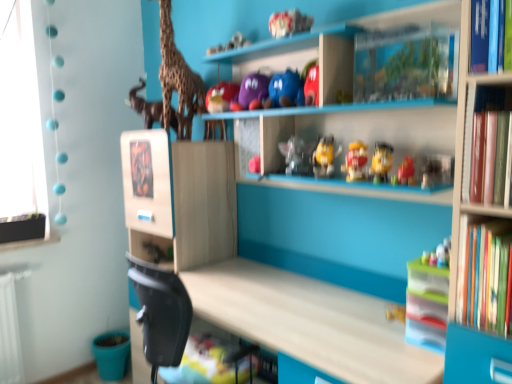
Measure the distance between matte purple plush at upper center, which appears as the first toy when viewed from the top, and camera.

The depth of matte purple plush at upper center, which appears as the first toy when viewed from the top, is 6.51 feet.

Where is `matte brown elephant at upper left`? matte brown elephant at upper left is located at coordinates tap(145, 106).

The image size is (512, 384). I want to click on translucent plastic toy at center, which ranks as the fifth toy in top-to-bottom order, so click(x=356, y=162).

The image size is (512, 384). What are the coordinates of `translucent plastic figurine at center, the 3th toy positioned from the top` in the screenshot? It's located at (296, 156).

At what (x,y) coordinates should I click in order to perform the action: click on hardcover books at right. Please return your answer as a coordinate pair (x, y). This screenshot has width=512, height=384. Looking at the image, I should click on (485, 276).

Find the location of a particular element. Image resolution: width=512 pixels, height=384 pixels. matte purple plush at upper center, acting as the 6th toy starting from the bottom is located at coordinates 230,44.

Does purple matte plush at upper center, acting as the 2th toy starting from the top, have a greater width compared to matte purple plush at upper center, acting as the 6th toy starting from the bottom?

Yes, purple matte plush at upper center, acting as the 2th toy starting from the top, is wider than matte purple plush at upper center, acting as the 6th toy starting from the bottom.

Which is correct: purple matte plush at upper center, the fifth toy when ordered from bottom to top, is inside matte purple plush at upper center, which appears as the first toy when viewed from the top, or outside of it?

purple matte plush at upper center, the fifth toy when ordered from bottom to top, is located beyond the bounds of matte purple plush at upper center, which appears as the first toy when viewed from the top.

From a real-world perspective, is purple matte plush at upper center, acting as the 2th toy starting from the top, positioned above or below matte purple plush at upper center, acting as the 6th toy starting from the bottom?

In terms of real-world spatial position, purple matte plush at upper center, acting as the 2th toy starting from the top, is below matte purple plush at upper center, acting as the 6th toy starting from the bottom.

Is the position of purple matte plush at upper center, the fifth toy when ordered from bottom to top, less distant than that of matte purple plush at upper center, acting as the 6th toy starting from the bottom?

Yes, it is in front of matte purple plush at upper center, acting as the 6th toy starting from the bottom.

From the image's perspective, is purple matte plush at upper center, the fifth toy when ordered from bottom to top, on top of wooden giraffe at upper left?

No.

Considering the positions of objects purple matte plush at upper center, acting as the 2th toy starting from the top, and wooden giraffe at upper left in the image provided, who is in front, purple matte plush at upper center, acting as the 2th toy starting from the top, or wooden giraffe at upper left?

purple matte plush at upper center, acting as the 2th toy starting from the top, is more forward.

In terms of height, does purple matte plush at upper center, acting as the 2th toy starting from the top, look taller or shorter compared to wooden giraffe at upper left?

purple matte plush at upper center, acting as the 2th toy starting from the top, is shorter than wooden giraffe at upper left.

Which of these two, purple matte plush at upper center, the fifth toy when ordered from bottom to top, or wooden giraffe at upper left, is thinner?

purple matte plush at upper center, the fifth toy when ordered from bottom to top.

Can you confirm if matte yellow toy at center, arranged as the sixth toy when viewed from the top, is taller than wooden giraffe at upper left?

Incorrect, the height of matte yellow toy at center, arranged as the sixth toy when viewed from the top, is not larger of that of wooden giraffe at upper left.

From a real-world perspective, is matte yellow toy at center, arranged as the sixth toy when viewed from the top, physically located above or below wooden giraffe at upper left?

From a real-world perspective, matte yellow toy at center, arranged as the sixth toy when viewed from the top, is physically below wooden giraffe at upper left.

Based on the photo, is matte yellow toy at center, which is the 1th toy from bottom to top, positioned with its back to wooden giraffe at upper left?

No, matte yellow toy at center, which is the 1th toy from bottom to top,'s orientation is not away from wooden giraffe at upper left.

Between matte yellow toy at center, which is the 1th toy from bottom to top, and wooden giraffe at upper left, which one has larger width?

Wider between the two is wooden giraffe at upper left.

Image resolution: width=512 pixels, height=384 pixels. Find the location of `book below the matte yellow toy at center, arranged as the sixth toy when viewed from the top (from the image's perspective)`. book below the matte yellow toy at center, arranged as the sixth toy when viewed from the top (from the image's perspective) is located at coordinates (485, 276).

Does hardcover books at right have a smaller size compared to matte yellow toy at center, which is the 1th toy from bottom to top?

No, hardcover books at right is not smaller than matte yellow toy at center, which is the 1th toy from bottom to top.

Is hardcover books at right aimed at matte yellow toy at center, arranged as the sixth toy when viewed from the top?

→ No, hardcover books at right does not turn towards matte yellow toy at center, arranged as the sixth toy when viewed from the top.

Is matte purple plush at upper center, acting as the 6th toy starting from the bottom, at the right side of hardcover books at right?

No, matte purple plush at upper center, acting as the 6th toy starting from the bottom, is not to the right of hardcover books at right.

Find the location of a particular element. This screenshot has height=384, width=512. toy that is the 6th one when counting backward from the hardcover books at right is located at coordinates (230, 44).

From a real-world perspective, which is physically below, matte purple plush at upper center, which appears as the first toy when viewed from the top, or hardcover books at right?

In real-world perspective, hardcover books at right is lower.

Choose the correct answer: Is matte purple plush at upper center, acting as the 6th toy starting from the bottom, inside hardcover books at right or outside it?

The correct answer is: outside.

Is wooden toy dinosaur at lower left wider or thinner than matte yellow toy at center, which is the 1th toy from bottom to top?

In the image, wooden toy dinosaur at lower left appears to be wider than matte yellow toy at center, which is the 1th toy from bottom to top.

Between wooden toy dinosaur at lower left and matte yellow toy at center, which is the 1th toy from bottom to top, which one is positioned behind?

wooden toy dinosaur at lower left is further away from the camera.

From a real-world perspective, is wooden toy dinosaur at lower left physically located above or below matte yellow toy at center, which is the 1th toy from bottom to top?

wooden toy dinosaur at lower left is situated lower than matte yellow toy at center, which is the 1th toy from bottom to top, in the real world.

Considering the positions of objects wooden toy dinosaur at lower left and matte yellow toy at center, arranged as the sixth toy when viewed from the top, in the image provided, who is more to the right, wooden toy dinosaur at lower left or matte yellow toy at center, arranged as the sixth toy when viewed from the top,?

From the viewer's perspective, matte yellow toy at center, arranged as the sixth toy when viewed from the top, appears more on the right side.

Which of these two, yellow matte toy at center, the fourth toy positioned from the top, or wooden toy dinosaur at lower left, is bigger?

wooden toy dinosaur at lower left.

Are yellow matte toy at center, the fourth toy positioned from the top, and wooden toy dinosaur at lower left far apart?

Yes, yellow matte toy at center, the fourth toy positioned from the top, and wooden toy dinosaur at lower left are located far from each other.

Could you measure the distance between yellow matte toy at center, the fourth toy positioned from the top, and wooden toy dinosaur at lower left?

yellow matte toy at center, the fourth toy positioned from the top, is 3.35 feet away from wooden toy dinosaur at lower left.

Is yellow matte toy at center, which is counted as the third toy, starting from the bottom, facing towards wooden toy dinosaur at lower left?

No.

Where is `toy behind the purple matte plush at upper center, the fifth toy when ordered from bottom to top`? The width and height of the screenshot is (512, 384). toy behind the purple matte plush at upper center, the fifth toy when ordered from bottom to top is located at coordinates (230, 44).

I want to click on giraffe positioned vertically above the purple matte plush at upper center, acting as the 2th toy starting from the top (from a real-world perspective), so (x=177, y=79).

Looking at this image, which object lies further to the anchor point wooden giraffe at upper left, yellow matte toy at center, which is counted as the third toy, starting from the bottom, or matte brown elephant at upper left?

The object further to wooden giraffe at upper left is yellow matte toy at center, which is counted as the third toy, starting from the bottom.

Which object lies nearer to the anchor point hardcover books at right, translucent plastic figurine at center, the 3th toy positioned from the top, or yellow matte toy at center, the fourth toy positioned from the top?

The object closer to hardcover books at right is yellow matte toy at center, the fourth toy positioned from the top.

Considering their positions, is wooden toy dinosaur at lower left positioned closer to wooden giraffe at upper left than translucent plastic figurine at center, the 3th toy positioned from the top?

translucent plastic figurine at center, the 3th toy positioned from the top, lies closer to wooden giraffe at upper left than the other object.

When comparing their distances from wooden giraffe at upper left, does hardcover books at right or matte yellow toy at center, which is the 1th toy from bottom to top, seem further?

hardcover books at right lies further to wooden giraffe at upper left than the other object.

Which object lies further to the anchor point wooden giraffe at upper left, translucent plastic toy at center, which ranks as the fifth toy in top-to-bottom order, or hardcover books at right?

The object further to wooden giraffe at upper left is hardcover books at right.

Estimate the real-world distances between objects in this image. Which object is further from matte brown elephant at upper left, wooden giraffe at upper left or matte purple plush at upper center, which appears as the first toy when viewed from the top?

The object further to matte brown elephant at upper left is matte purple plush at upper center, which appears as the first toy when viewed from the top.

When comparing their distances from wooden toy dinosaur at lower left, does matte purple plush at upper center, which appears as the first toy when viewed from the top, or matte yellow toy at center, which is the 1th toy from bottom to top, seem further?

matte yellow toy at center, which is the 1th toy from bottom to top, is further to wooden toy dinosaur at lower left.

Estimate the real-world distances between objects in this image. Which object is closer to matte brown elephant at upper left, wooden giraffe at upper left or purple matte plush at upper center, the fifth toy when ordered from bottom to top?

Among the two, wooden giraffe at upper left is located nearer to matte brown elephant at upper left.

Find the location of a particular element. The width and height of the screenshot is (512, 384). shelf between matte brown elephant at upper left and yellow matte toy at center, the fourth toy positioned from the top is located at coordinates (151, 250).

Find the location of a particular element. giraffe between matte brown elephant at upper left and translucent plastic figurine at center, the 3th toy positioned from the top, in the horizontal direction is located at coordinates (177, 79).

Where is `toy situated between matte brown elephant at upper left and purple matte plush at upper center, the fifth toy when ordered from bottom to top, from left to right`? toy situated between matte brown elephant at upper left and purple matte plush at upper center, the fifth toy when ordered from bottom to top, from left to right is located at coordinates (230, 44).

The height and width of the screenshot is (384, 512). Find the location of `giraffe between matte brown elephant at upper left and matte purple plush at upper center, acting as the 6th toy starting from the bottom`. giraffe between matte brown elephant at upper left and matte purple plush at upper center, acting as the 6th toy starting from the bottom is located at coordinates (177, 79).